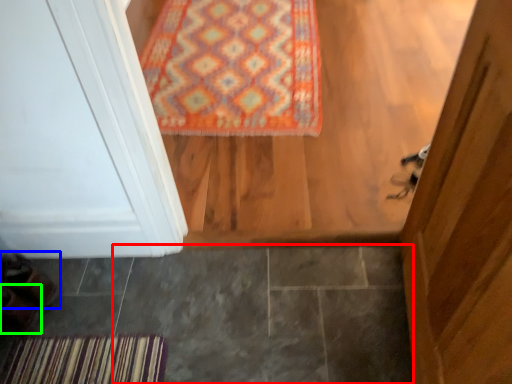
Question: Which is farther away from tile (highlighted by a red box)? shoe (highlighted by a blue box) or shoe (highlighted by a green box)?

Choices:
 (A) shoe
 (B) shoe

Answer: (B)